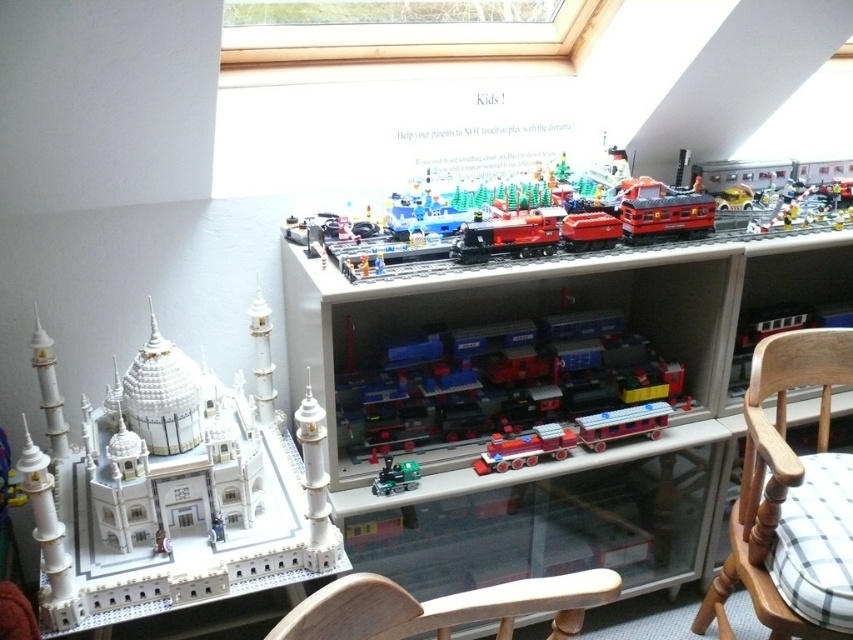
Can you confirm if wooden chair at lower right is positioned to the left of wooden chair at lower center?

In fact, wooden chair at lower right is to the right of wooden chair at lower center.

Who is higher up, wooden chair at lower right or wooden chair at lower center?

wooden chair at lower center

The image size is (853, 640). What are the coordinates of `wooden chair at lower right` in the screenshot? It's located at (776, 483).

At what (x,y) coordinates should I click in order to perform the action: click on wooden chair at lower right. Please return your answer as a coordinate pair (x, y). Looking at the image, I should click on (776, 483).

Who is positioned more to the left, white glossy lego taj mahal at lower left or red plastic train at center?

white glossy lego taj mahal at lower left is more to the left.

Can you confirm if white glossy lego taj mahal at lower left is taller than red plastic train at center?

Yes.

Locate an element on the screen. This screenshot has height=640, width=853. white glossy lego taj mahal at lower left is located at coordinates (173, 488).

Between brick red plastic train set at upper center and shiny red train at center, which one is positioned lower?

shiny red train at center

At what (x,y) coordinates should I click in order to perform the action: click on brick red plastic train set at upper center. Please return your answer as a coordinate pair (x, y). The height and width of the screenshot is (640, 853). Looking at the image, I should click on (590, 220).